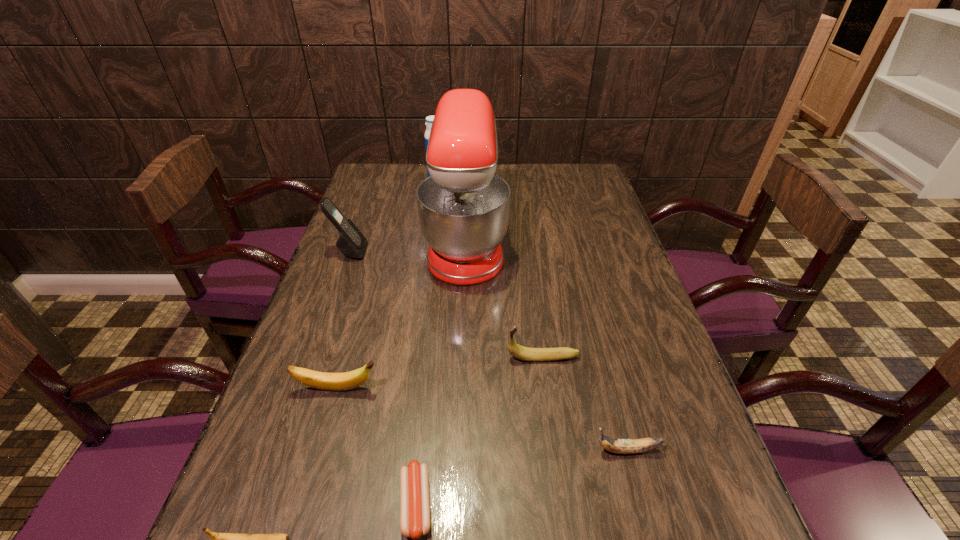
This screenshot has height=540, width=960. In order to click on banana that is the third nearest to the tallest object in this screenshot , I will do `click(619, 446)`.